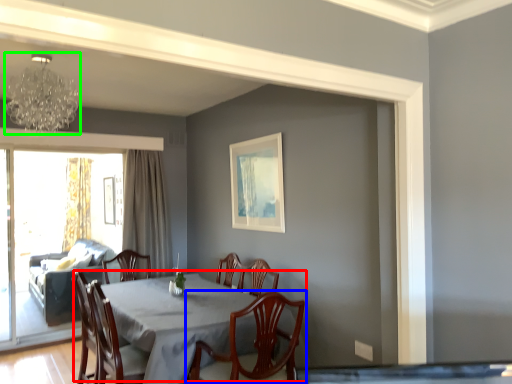
Question: Considering the real-world distances, which object is closest to kitchen & dining room table (highlighted by a red box)? chair (highlighted by a blue box) or lamp (highlighted by a green box).

Choices:
 (A) chair
 (B) lamp

Answer: (A)